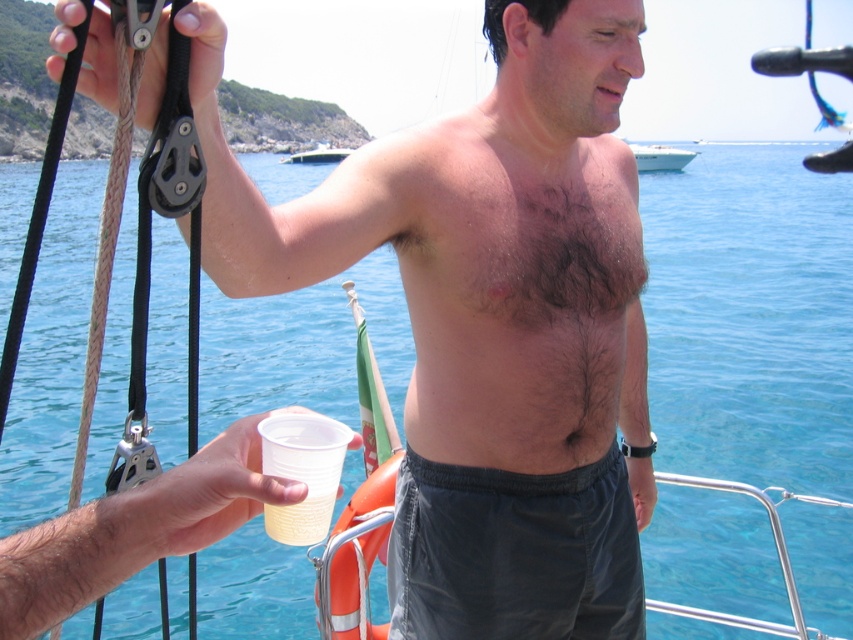
Does smooth plastic cup at center appear on the left side of translucent plastic cup at lower center?

Incorrect, smooth plastic cup at center is not on the left side of translucent plastic cup at lower center.

Between smooth plastic cup at center and translucent plastic cup at lower center, which one is positioned lower?

translucent plastic cup at lower center is below.

Measure the distance between point (596, 476) and camera.

A distance of 2.70 meters exists between point (596, 476) and camera.

Locate an element on the screen. Image resolution: width=853 pixels, height=640 pixels. smooth plastic cup at center is located at coordinates (488, 316).

Does brown hairy chest at center appear over white glossy boat at upper center?

No, brown hairy chest at center is not above white glossy boat at upper center.

Can you confirm if brown hairy chest at center is wider than white glossy boat at upper center?

Incorrect, brown hairy chest at center's width does not surpass white glossy boat at upper center's.

This screenshot has width=853, height=640. What are the coordinates of `brown hairy chest at center` in the screenshot? It's located at (520, 298).

Who is positioned more to the left, white glossy boat at upper center or white plastic cup at upper center?

white plastic cup at upper center

Can you confirm if white glossy boat at upper center is smaller than white plastic cup at upper center?

No, white glossy boat at upper center is not smaller than white plastic cup at upper center.

Image resolution: width=853 pixels, height=640 pixels. I want to click on white glossy boat at upper center, so (660, 157).

I want to click on white glossy boat at upper center, so click(660, 157).